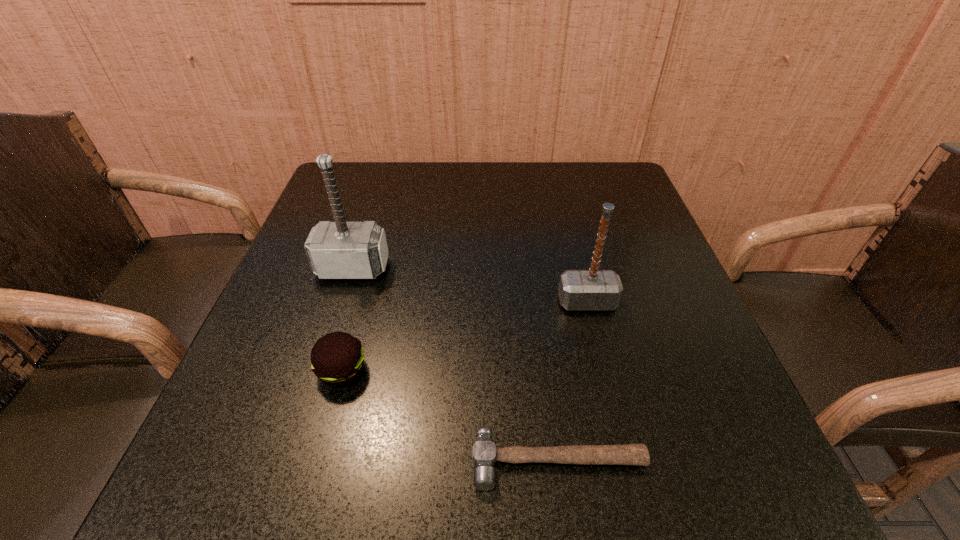
Image resolution: width=960 pixels, height=540 pixels. Identify the location of free space at the far right corner of the desktop. (602, 167).

This screenshot has height=540, width=960. In the image, there is a desktop. Identify the location of vacant space at the near right corner. (744, 472).

You are a GUI agent. You are given a task and a screenshot of the screen. Output one action in this format:
    pyautogui.click(x=<x>, y=<y>)
    Task: Click on the vacant area between the third nearest object and the third tallest object
    This screenshot has height=540, width=960.
    Given the screenshot: What is the action you would take?
    pyautogui.click(x=465, y=336)

Find the location of a particular element. empty space between the second shortest object and the second nearest hammer is located at coordinates (465, 336).

You are a GUI agent. You are given a task and a screenshot of the screen. Output one action in this format:
    pyautogui.click(x=<x>, y=<y>)
    Task: Click on the free spot between the farthest object and the second nearest object
    Image resolution: width=960 pixels, height=540 pixels.
    Given the screenshot: What is the action you would take?
    pyautogui.click(x=348, y=319)

Find the location of a particular element. This screenshot has height=540, width=960. unoccupied position between the second tallest hammer and the farthest object is located at coordinates (469, 285).

Locate an element on the screen. This screenshot has width=960, height=540. free space between the nearest hammer and the second farthest object is located at coordinates (573, 382).

The width and height of the screenshot is (960, 540). Find the location of `free spot between the leftmost hammer and the nearest hammer`. free spot between the leftmost hammer and the nearest hammer is located at coordinates (456, 364).

At what (x,y) coordinates should I click in order to perform the action: click on free space between the nearest object and the third tallest object. Please return your answer as a coordinate pair (x, y). Image resolution: width=960 pixels, height=540 pixels. Looking at the image, I should click on (450, 416).

Locate an element on the screen. free space between the shortest object and the second shortest object is located at coordinates (450, 416).